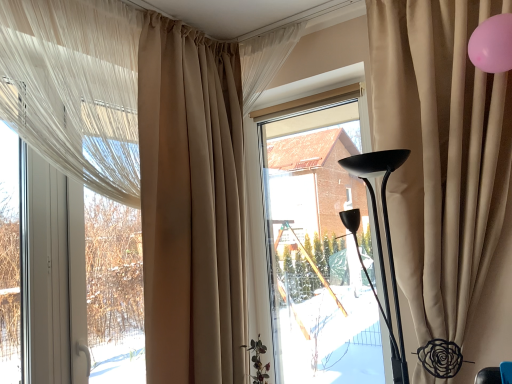
Question: Is transparent glass window at center spatially inside beige fabric curtain at upper center, which ranks as the 2th curtain in right-to-left order, or outside of it?

Choices:
 (A) outside
 (B) inside

Answer: (A)

Question: From a real-world perspective, is transparent glass window at center physically located above or below beige fabric curtain at upper center, acting as the third curtain starting from the left?

Choices:
 (A) above
 (B) below

Answer: (B)

Question: Which is farther from the beige fabric curtain at left, the 2th curtain when ordered from left to right?

Choices:
 (A) translucent white curtain at left, which is the fourth curtain in right-to-left order
 (B) beige fabric curtain at upper center, acting as the third curtain starting from the left
 (C) beige velvet curtain at right, acting as the 4th curtain starting from the left
 (D) transparent glass window at center

Answer: (C)

Question: Which of these objects is positioned farthest from the beige fabric curtain at left, the 2th curtain when ordered from left to right?

Choices:
 (A) beige velvet curtain at right, the 1th curtain positioned from the right
 (B) translucent white curtain at left, which is the fourth curtain in right-to-left order
 (C) beige fabric curtain at upper center, which ranks as the 2th curtain in right-to-left order
 (D) transparent glass window at center

Answer: (A)